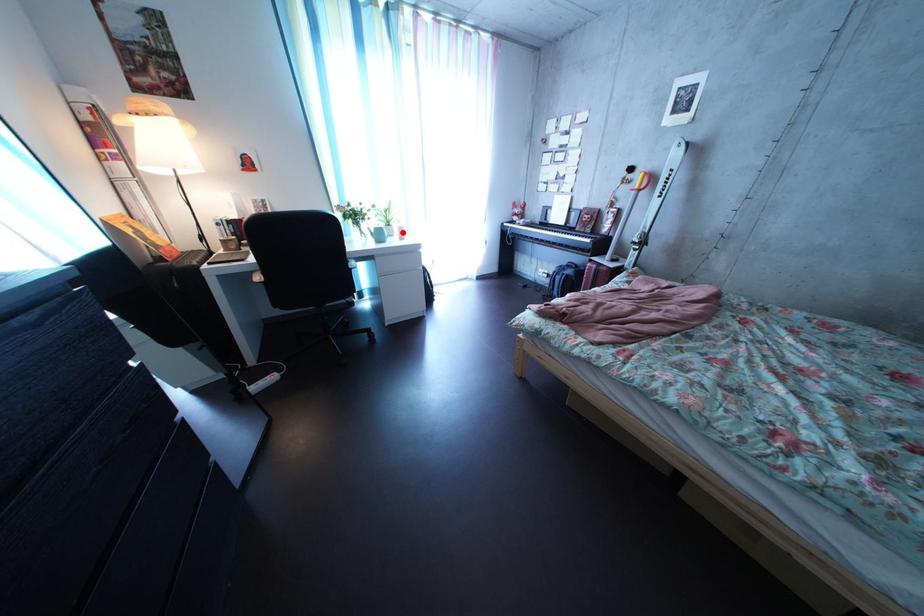
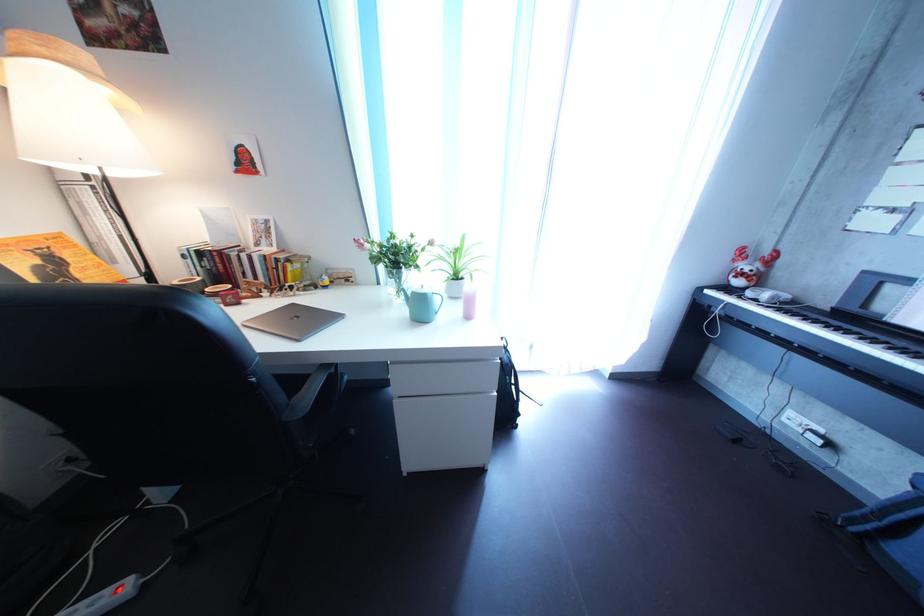
Locate, in the second image, the point that corresponds to the highlighted location in the first image.

(469, 285)